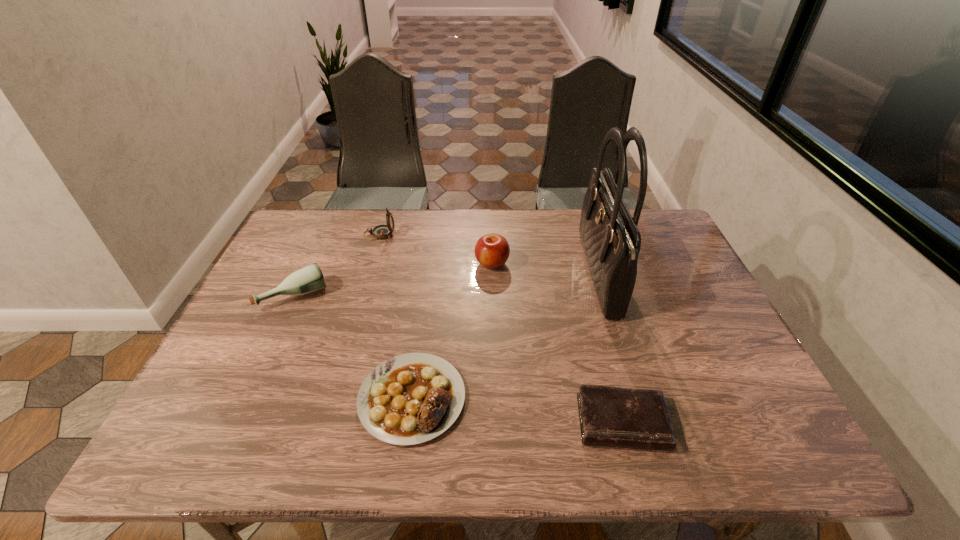
Where is `vacant area that lies between the diary and the fourth object from left to right`? The image size is (960, 540). vacant area that lies between the diary and the fourth object from left to right is located at coordinates (557, 343).

Locate an element on the screen. unoccupied position between the fourth object from left to right and the fourth object from right to left is located at coordinates (452, 330).

Image resolution: width=960 pixels, height=540 pixels. In order to click on unoccupied area between the second shortest object and the third object from right to left in this screenshot , I will do `click(452, 330)`.

Identify the location of free spot between the steak and the handbag. The height and width of the screenshot is (540, 960). (505, 336).

The image size is (960, 540). I want to click on free space that is in between the fifth tallest object and the handbag, so [505, 336].

Identify the location of vacant area between the third object from left to right and the fifth object from right to left. The image size is (960, 540). (396, 316).

Find the location of a particular element. The image size is (960, 540). object that is the fourth closest to the leftmost object is located at coordinates (609, 416).

Identify the location of object that is the third nearest to the third object from left to right. Image resolution: width=960 pixels, height=540 pixels. (492, 250).

Where is `free location that satisfies the following two spatial constraints: 1. on the back side of the third object from right to left; 2. on the left side of the steak`? free location that satisfies the following two spatial constraints: 1. on the back side of the third object from right to left; 2. on the left side of the steak is located at coordinates (430, 264).

Identify the location of free spot that satisfies the following two spatial constraints: 1. on the face of the compass; 2. on the left side of the diary. The width and height of the screenshot is (960, 540). (324, 422).